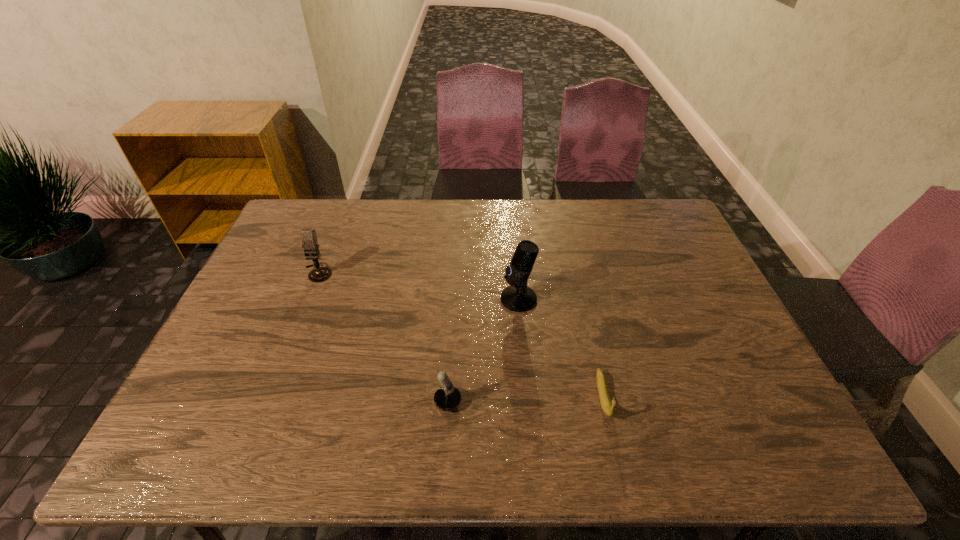
Identify which object is located as the third nearest to the farthest microphone. Please provide its 2D coordinates. Your answer should be formatted as a tuple, i.e. [(x, y)], where the tuple contains the x and y coordinates of a point satisfying the conditions above.

[(608, 408)]

Image resolution: width=960 pixels, height=540 pixels. Identify the location of object that can be found as the closest to the second shortest microphone. (446, 398).

The width and height of the screenshot is (960, 540). Find the location of `microphone that can be found as the second closest to the banana`. microphone that can be found as the second closest to the banana is located at coordinates (446, 398).

Where is `microphone that is the second closest to the nearest microphone`? This screenshot has height=540, width=960. microphone that is the second closest to the nearest microphone is located at coordinates (310, 244).

Locate an element on the screen. The image size is (960, 540). vacant point that satisfies the following two spatial constraints: 1. on the front-facing side of the third tallest object; 2. on the right side of the farthest object is located at coordinates (266, 403).

The height and width of the screenshot is (540, 960). What are the coordinates of `vacant area that satisfies the following two spatial constraints: 1. on the front-facing side of the second object from left to right; 2. on the left side of the second tallest object` in the screenshot? It's located at (266, 403).

Image resolution: width=960 pixels, height=540 pixels. What are the coordinates of `free space that satisfies the following two spatial constraints: 1. on the front-facing side of the farthest object; 2. on the left side of the second shortest object` in the screenshot? It's located at (266, 403).